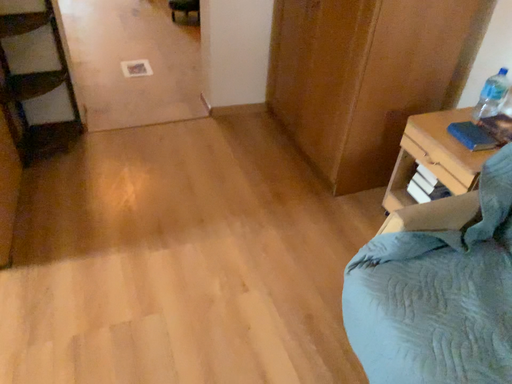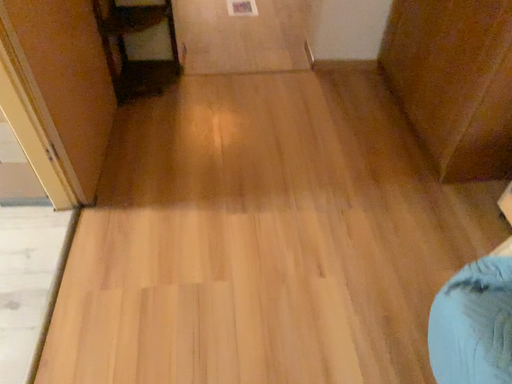
Question: Which way did the camera rotate in the video?

Choices:
 (A) rotated upward
 (B) rotated downward

Answer: (B)